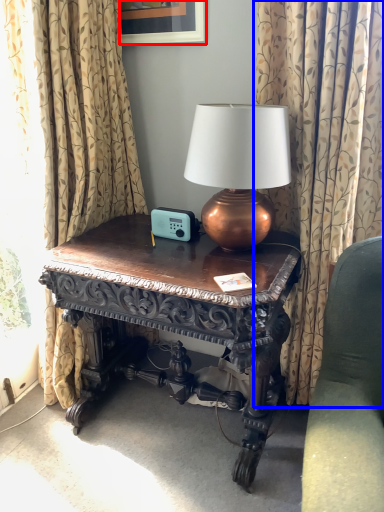
Question: Among these objects, which one is nearest to the camera, picture frame (highlighted by a red box) or curtain (highlighted by a blue box)?

Choices:
 (A) picture frame
 (B) curtain

Answer: (B)